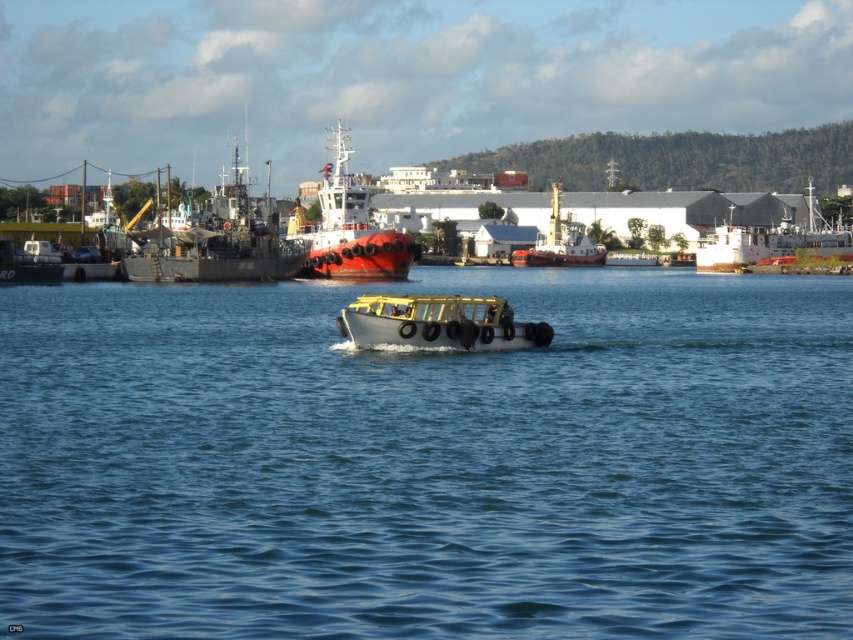
You are a photographer trying to capture the white matte ship at upper right and the clear blue water at center in a single shot. Based on their positions, which object will appear closer to the bottom edge of your camera frame?

The clear blue water at center will appear closer to the bottom edge of the camera frame because it is positioned lower than the white matte ship at upper right.

What are the coordinates of the clear blue water at center?

The clear blue water at center is located at point (x=428, y=461).

You are standing at the point with coordinates point (276, 260) and want to walk to the point with coordinates point (489, 317). Which direction should you move to get closer to your destination?

Since point (276, 260) is behind point (489, 317), you should move forward to get closer to your destination.